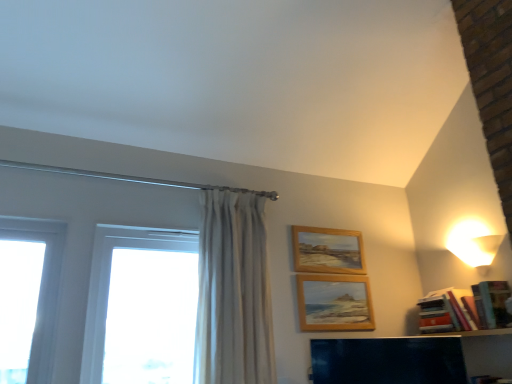
Question: In the image, is wooden picture frame at center, which appears as the 2th picture frame when viewed from the top, positioned in front of or behind white glass window at left?

Choices:
 (A) behind
 (B) front

Answer: (A)

Question: Considering the positions of wooden picture frame at center, which ranks as the 1th picture frame in bottom-to-top order, and white glass window at left in the image, is wooden picture frame at center, which ranks as the 1th picture frame in bottom-to-top order, bigger or smaller than white glass window at left?

Choices:
 (A) small
 (B) big

Answer: (A)

Question: Which object is the farthest from the wooden picture frame at upper center, the 1th picture frame from the top?

Choices:
 (A) wooden shelf at lower right
 (B) white glossy lampshade at upper right
 (C) hardcover books at right
 (D) wooden picture frame at center, which appears as the 2th picture frame when viewed from the top
 (E) white glass window at left

Answer: (E)

Question: Which of these objects is positioned closest to the white glossy lampshade at upper right?

Choices:
 (A) wooden picture frame at center, which appears as the 2th picture frame when viewed from the top
 (B) wooden picture frame at upper center, the 2th picture frame in the bottom-to-top sequence
 (C) hardcover books at right
 (D) white glass window at left
 (E) wooden shelf at lower right

Answer: (C)